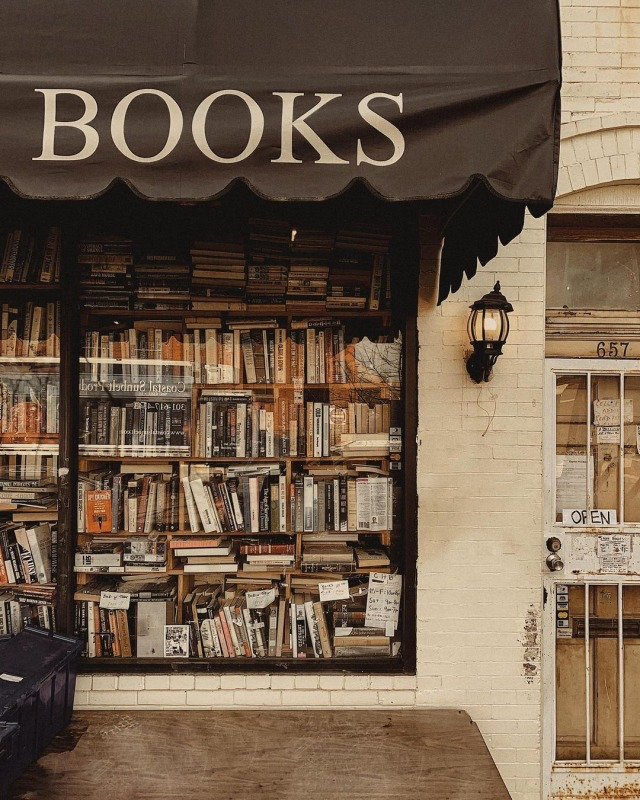
In order to click on light bulb in this screenshot , I will do `click(488, 320)`.